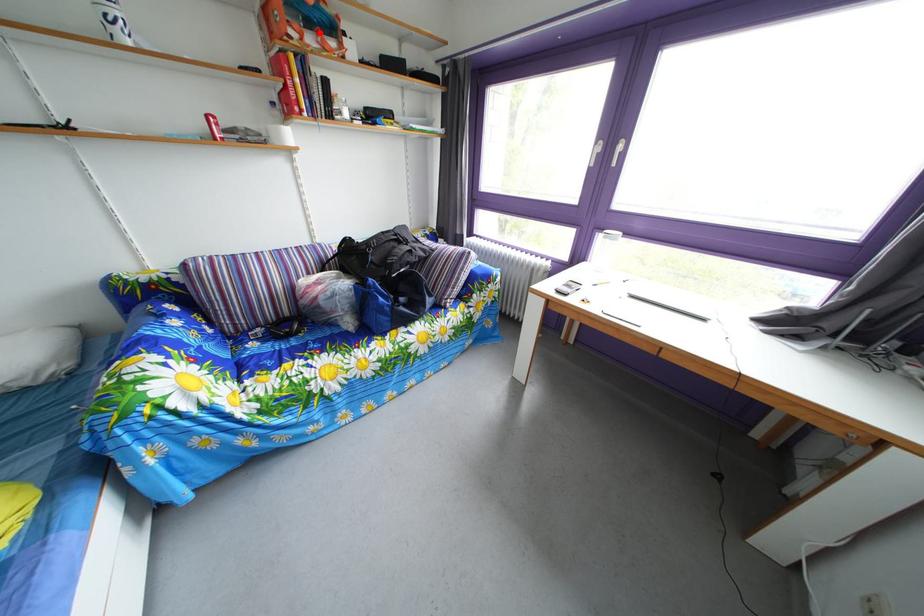
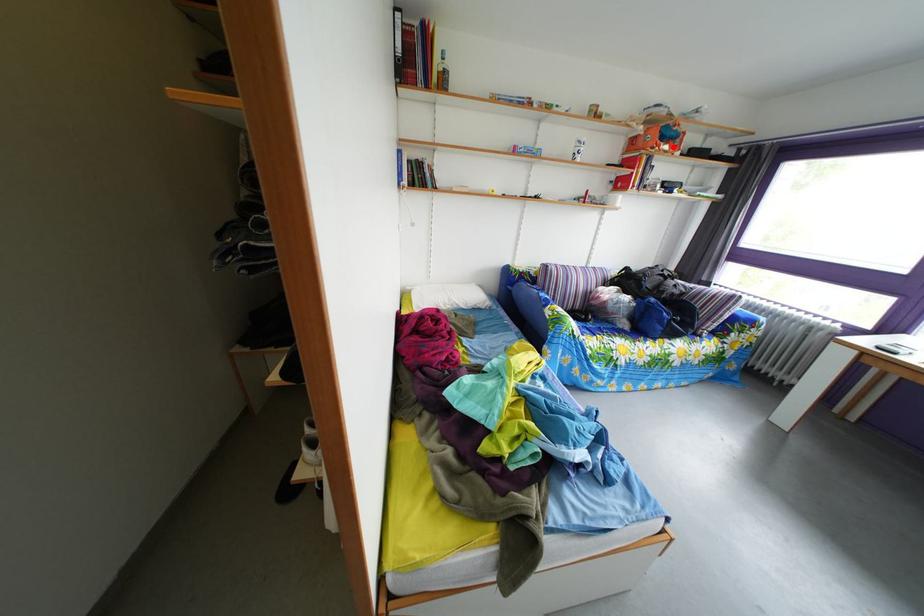
I am providing you with two images of the same scene from different viewpoints. A red point is marked on the first image and another point is marked on the second image. Is the marked point in image1 the same physical position as the marked point in image2?

Yes